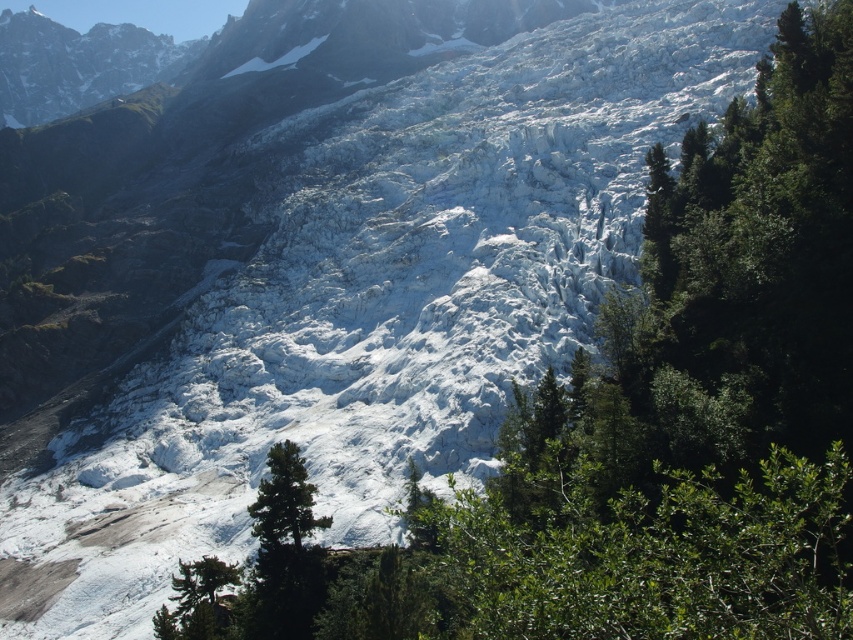
Question: Does green matte tree at center have a larger size compared to green textured tree at lower left?

Choices:
 (A) yes
 (B) no

Answer: (A)

Question: Can you confirm if green matte tree at center is positioned below green textured tree at lower left?

Choices:
 (A) yes
 (B) no

Answer: (B)

Question: Which object is farther from the camera taking this photo?

Choices:
 (A) green matte tree at center
 (B) green textured tree at lower left

Answer: (A)

Question: Does green matte tree at center have a larger size compared to green textured tree at lower left?

Choices:
 (A) yes
 (B) no

Answer: (A)